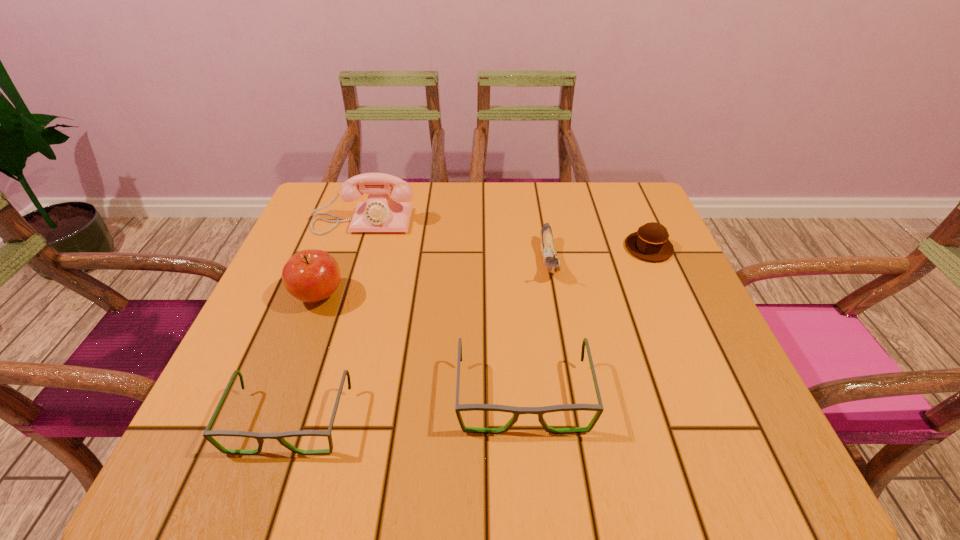
Where is `free location located 0.290m on the right of the second tallest object`? free location located 0.290m on the right of the second tallest object is located at coordinates (480, 296).

What are the coordinates of `telephone at the far edge` in the screenshot? It's located at (380, 213).

The height and width of the screenshot is (540, 960). Identify the location of muffin that is at the far edge. click(650, 242).

Image resolution: width=960 pixels, height=540 pixels. What are the coordinates of `spectacles that is at the left edge` in the screenshot? It's located at (207, 434).

At what (x,y) coordinates should I click in order to perform the action: click on telephone that is at the left edge. Please return your answer as a coordinate pair (x, y). This screenshot has width=960, height=540. Looking at the image, I should click on (380, 213).

Find the location of a particular element. Image resolution: width=960 pixels, height=540 pixels. apple at the left edge is located at coordinates (311, 275).

You are a GUI agent. You are given a task and a screenshot of the screen. Output one action in this format:
    pyautogui.click(x=<x>, y=<y>)
    Task: Click on the object present at the right edge
    Image resolution: width=960 pixels, height=540 pixels.
    Given the screenshot: What is the action you would take?
    pyautogui.click(x=650, y=242)

Image resolution: width=960 pixels, height=540 pixels. I want to click on object present at the far left corner, so click(x=380, y=213).

Find the location of `object that is at the near left corner`. object that is at the near left corner is located at coordinates (207, 434).

Where is `object at the far right corner`? object at the far right corner is located at coordinates [x=650, y=242].